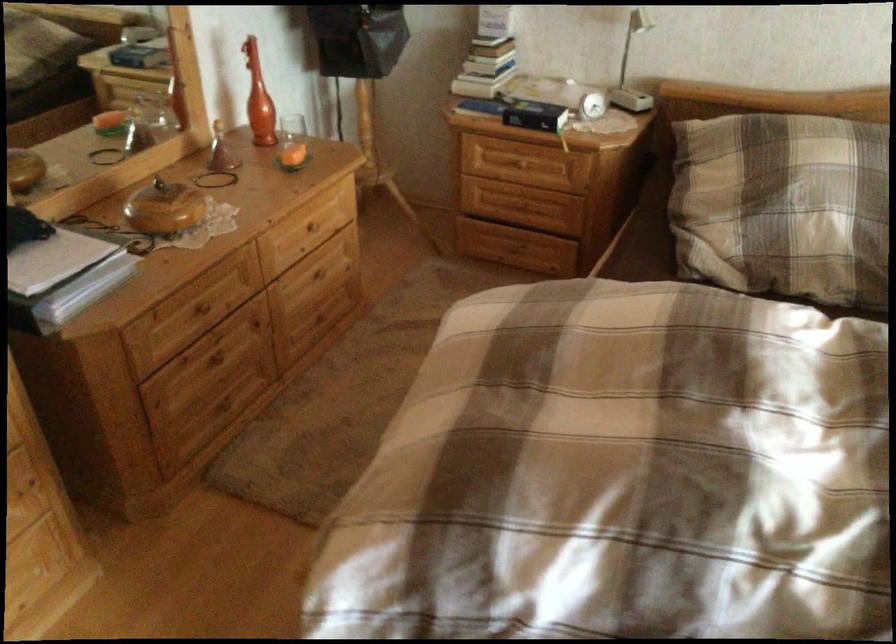
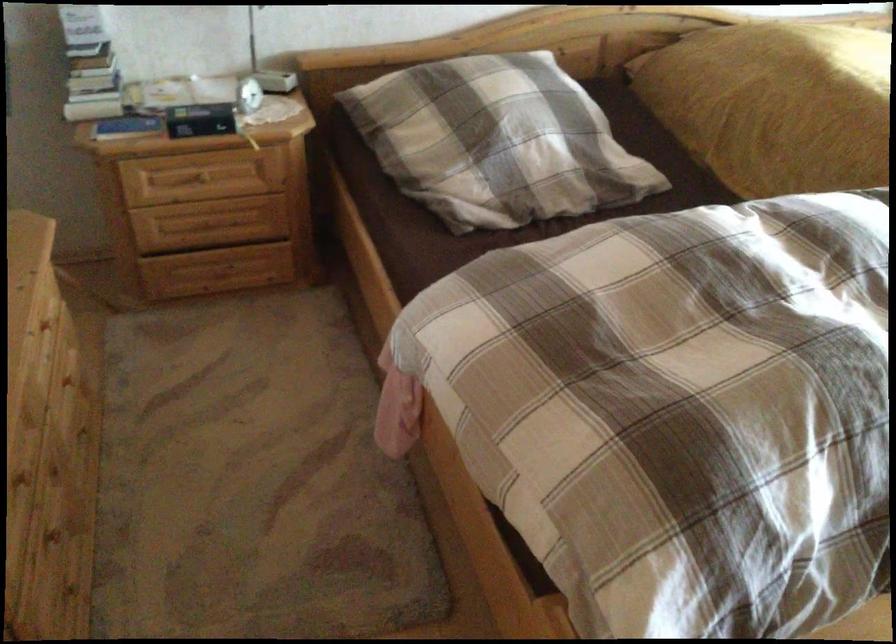
Question: The camera is either moving clockwise (left) or counter-clockwise (right) around the object. The first image is from the beginning of the video and the second image is from the end. Is the camera moving left or right when shooting the video?

Choices:
 (A) Left
 (B) Right

Answer: (A)